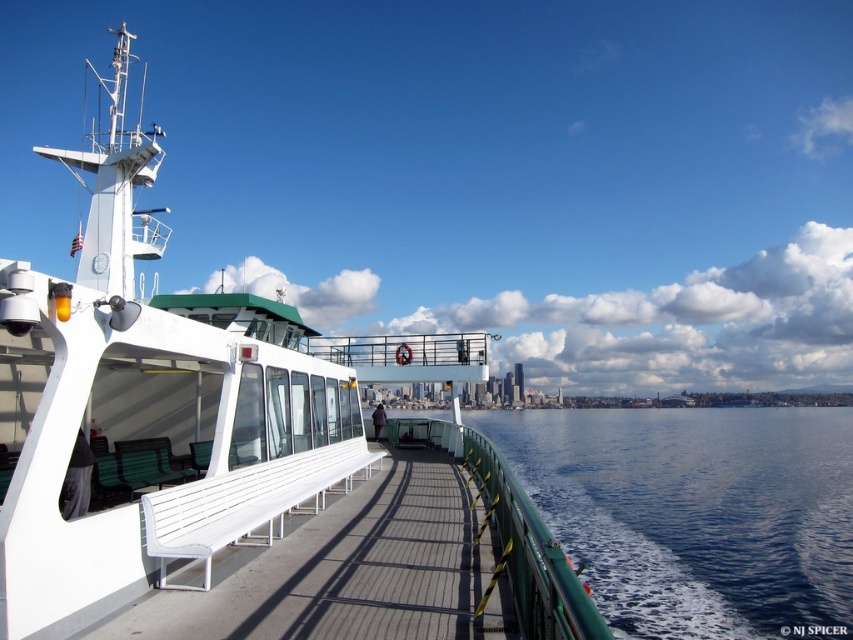
You are standing on the ferry deck and want to sit down. You see the white matte bench at center and the blue water at center. Which object is closer to your right side?

The blue water at center is to the right of the white matte bench at center, so if you are facing forward on the deck, the blue water at center would be closer to your right side.

You are a passenger on the ferry and need to sit down. The white matte bench at center and the blue water at center are both visible. Which one is bigger and would be more suitable for sitting?

The white matte bench at center is larger in size than the blue water at center, so it is more suitable for sitting.